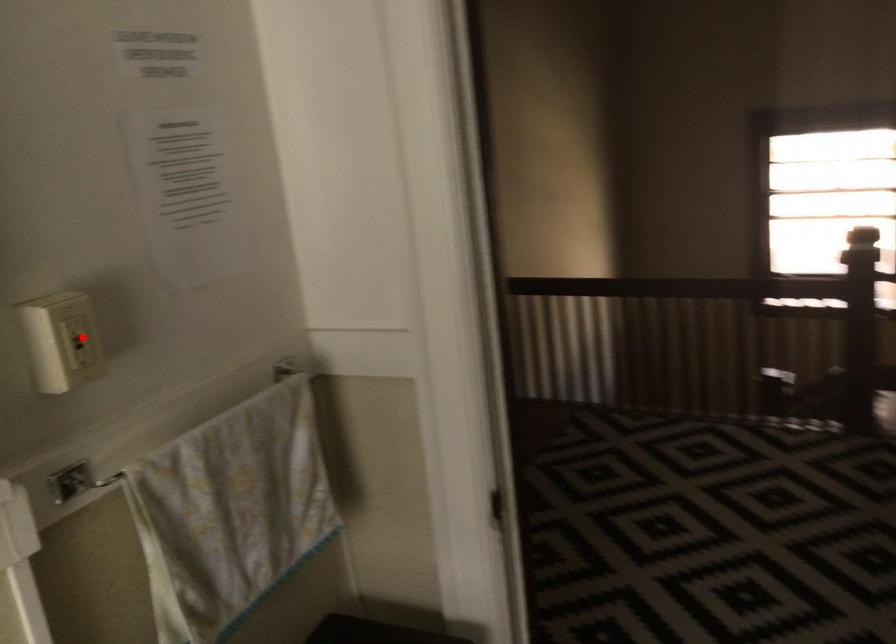
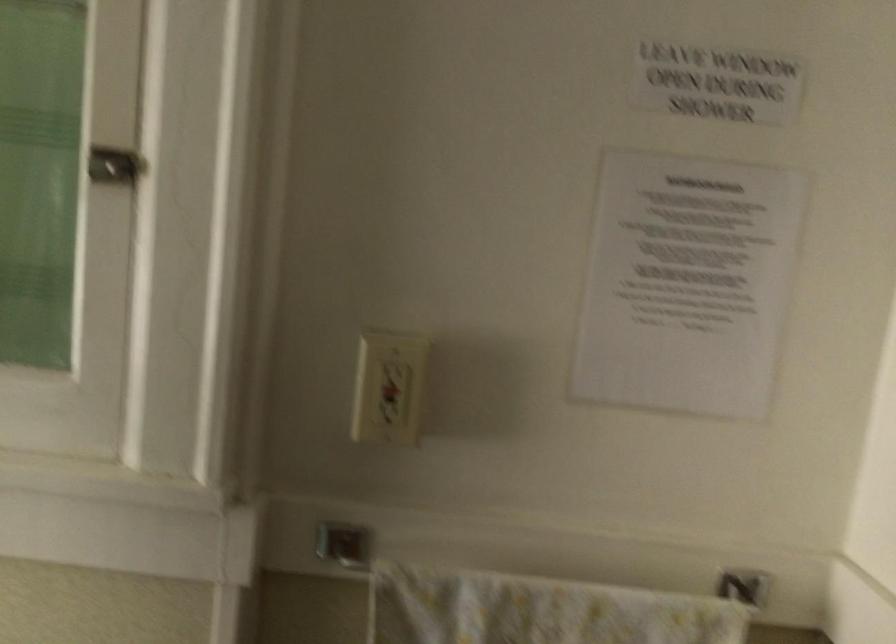
Question: I am providing you with two images of the same scene from different viewpoints. A red point is shown in image1. For the corresponding object point in image2, is it positioned nearer or farther from the camera?

Choices:
 (A) Nearer
 (B) Farther

Answer: (A)